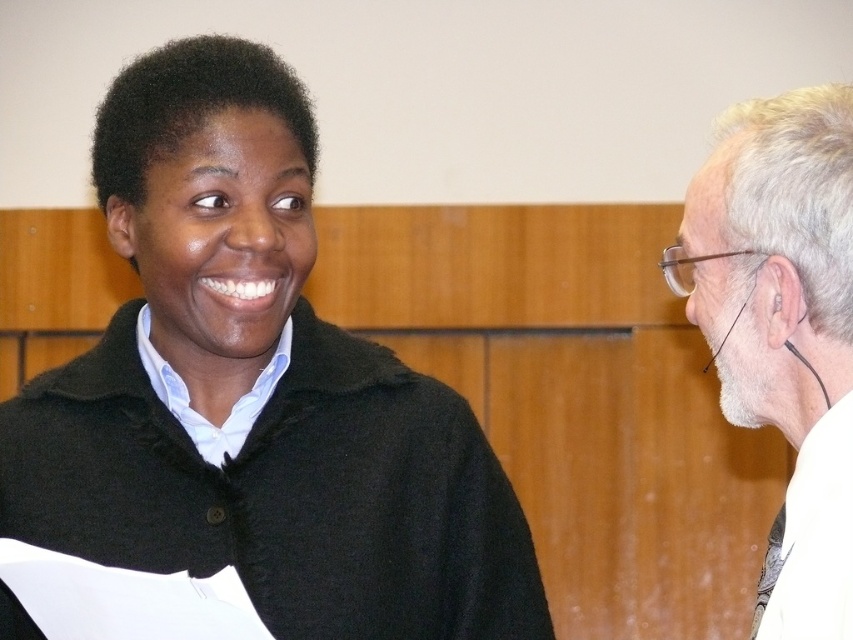
Does black wool sweater at upper left have a greater height compared to white hair at right?

Yes, black wool sweater at upper left is taller than white hair at right.

Which is more to the right, black wool sweater at upper left or white hair at right?

From the viewer's perspective, white hair at right appears more on the right side.

Between point (450, 579) and point (811, 304), which one is positioned behind?

Positioned behind is point (450, 579).

Where is `black wool sweater at upper left`? This screenshot has width=853, height=640. black wool sweater at upper left is located at coordinates pos(254,392).